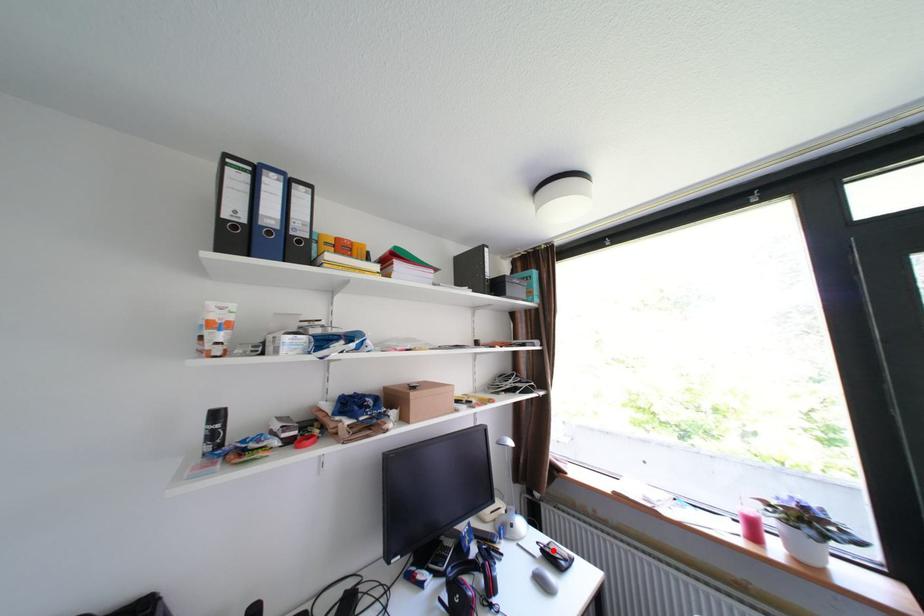
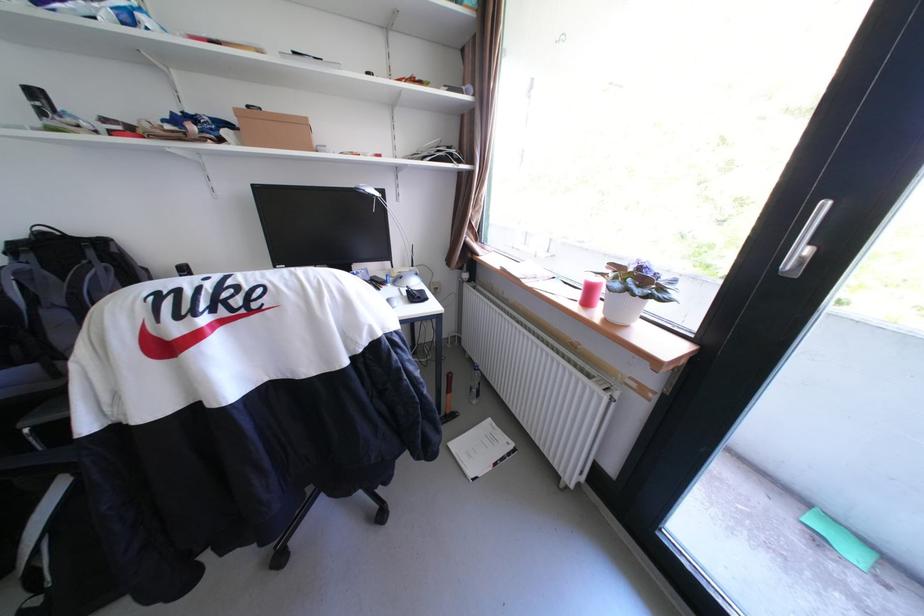
Where in the second image is the point corresponding to the highlighted location from the first image?

(418, 291)